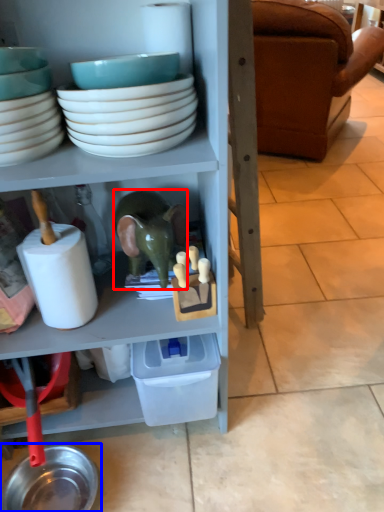
Question: Which of the following is the closest to the observer, toy (highlighted by a red box) or tableware (highlighted by a blue box)?

Choices:
 (A) toy
 (B) tableware

Answer: (A)